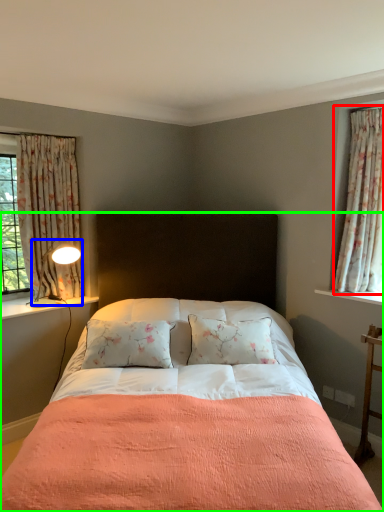
Question: Estimate the real-world distances between objects in this image. Which object is closer to curtain (highlighted by a red box), light fixture (highlighted by a blue box) or bed (highlighted by a green box)?

Choices:
 (A) light fixture
 (B) bed

Answer: (B)